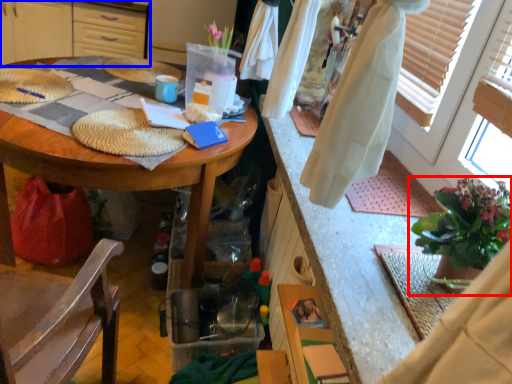
Question: Which object is further to the camera taking this photo, houseplant (highlighted by a red box) or cabinetry (highlighted by a blue box)?

Choices:
 (A) houseplant
 (B) cabinetry

Answer: (B)